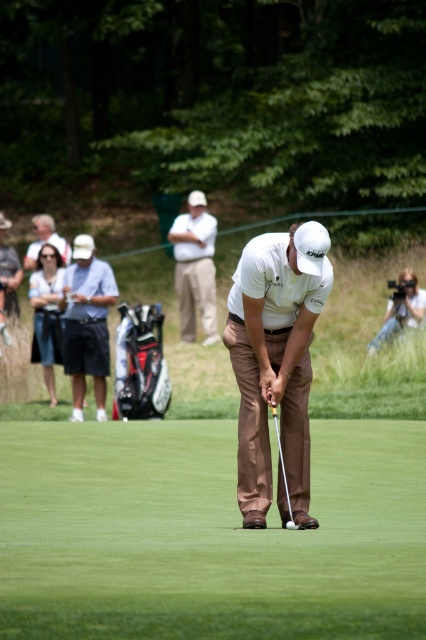
Question: Which point appears farthest from the camera in this image?

Choices:
 (A) (92, 246)
 (B) (8, 289)

Answer: (B)

Question: Considering the relative positions of white matte golf club at center and metallic silver golf club at center in the image provided, where is white matte golf club at center located with respect to metallic silver golf club at center?

Choices:
 (A) below
 (B) above

Answer: (B)

Question: Does dark blue cotton shorts at left appear under white matte golf ball at center?

Choices:
 (A) no
 (B) yes

Answer: (A)

Question: Among these objects, which one is farthest from the camera?

Choices:
 (A) matte white cap at upper center
 (B) white cotton shirt at upper center
 (C) matte white shirt at center
 (D) matte white camera at right

Answer: (B)

Question: Is white cotton shirt at upper center thinner than matte white camera at right?

Choices:
 (A) no
 (B) yes

Answer: (A)

Question: Which point is farther from the camera taking this photo?

Choices:
 (A) (204, 204)
 (B) (262, 506)

Answer: (A)